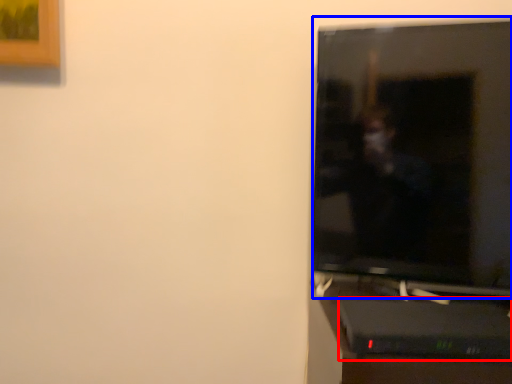
Question: Which point is closer to the camera, computer desk (highlighted by a red box) or television (highlighted by a blue box)?

Choices:
 (A) computer desk
 (B) television

Answer: (A)